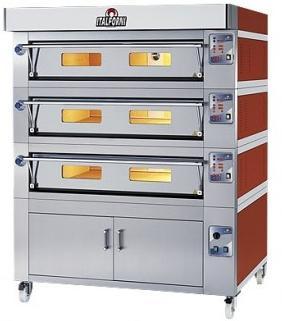
The image size is (282, 321). What are the coordinates of `windows` in the screenshot? It's located at coord(143,173), coord(100,171), coord(159,56), coord(146,114), coord(74,57), coord(85,82), coord(82,117).